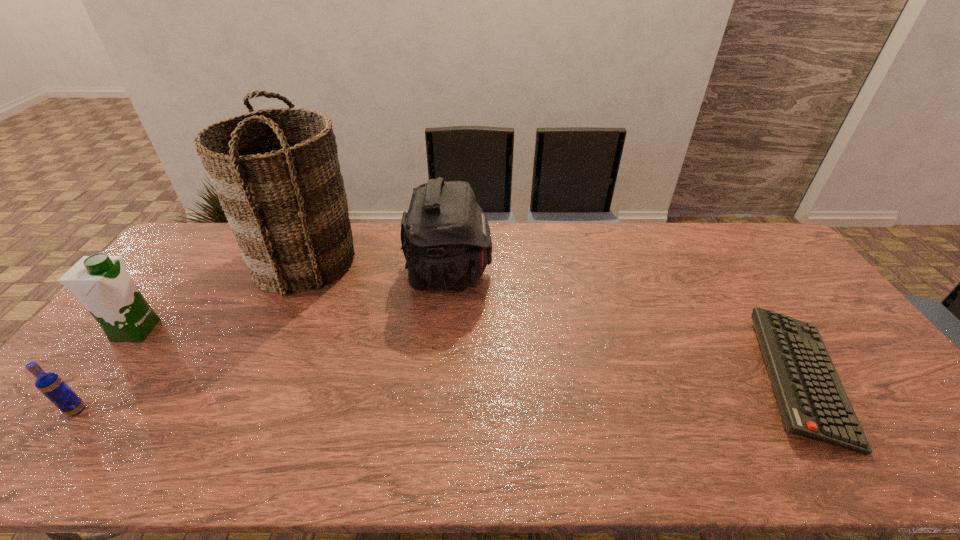
The image size is (960, 540). Find the location of `free space located 0.060m on the front-facing side of the third shortest object`. free space located 0.060m on the front-facing side of the third shortest object is located at coordinates (177, 330).

You are a GUI agent. You are given a task and a screenshot of the screen. Output one action in this format:
    pyautogui.click(x=<x>, y=<y>)
    Task: Click on the free point located on the front of the second shortest object
    The image size is (960, 540).
    Given the screenshot: What is the action you would take?
    pyautogui.click(x=49, y=446)

This screenshot has width=960, height=540. I want to click on free space located on the back of the computer keyboard, so click(714, 249).

Locate an element on the screen. This screenshot has height=540, width=960. basket situated at the far edge is located at coordinates (276, 172).

This screenshot has height=540, width=960. Find the location of `shoulder bag that is at the far edge`. shoulder bag that is at the far edge is located at coordinates (446, 240).

Where is `object that is at the near edge`? object that is at the near edge is located at coordinates (813, 402).

The height and width of the screenshot is (540, 960). I want to click on soya milk located in the left edge section of the desktop, so click(101, 282).

Locate an element on the screen. The image size is (960, 540). vodka that is at the left edge is located at coordinates (49, 384).

The height and width of the screenshot is (540, 960). Find the location of `object that is positioned at the right edge`. object that is positioned at the right edge is located at coordinates (813, 402).

This screenshot has width=960, height=540. I want to click on object at the near right corner, so click(x=813, y=402).